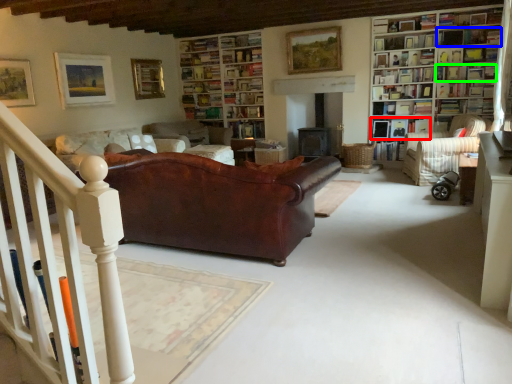
Question: Estimate the real-world distances between objects in this image. Which object is closer to book (highlighted by a red box), shelf (highlighted by a blue box) or book (highlighted by a green box)?

Choices:
 (A) shelf
 (B) book

Answer: (B)